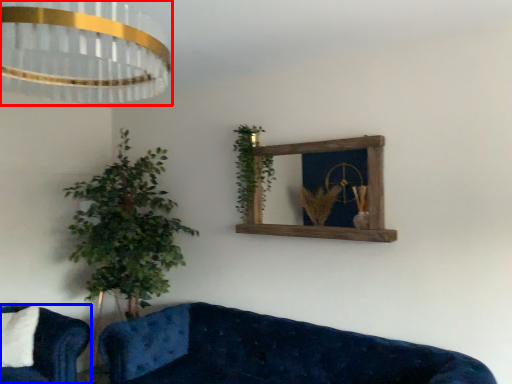
Question: Which object appears farthest to the camera in this image, lamp (highlighted by a red box) or studio couch (highlighted by a blue box)?

Choices:
 (A) lamp
 (B) studio couch

Answer: (B)